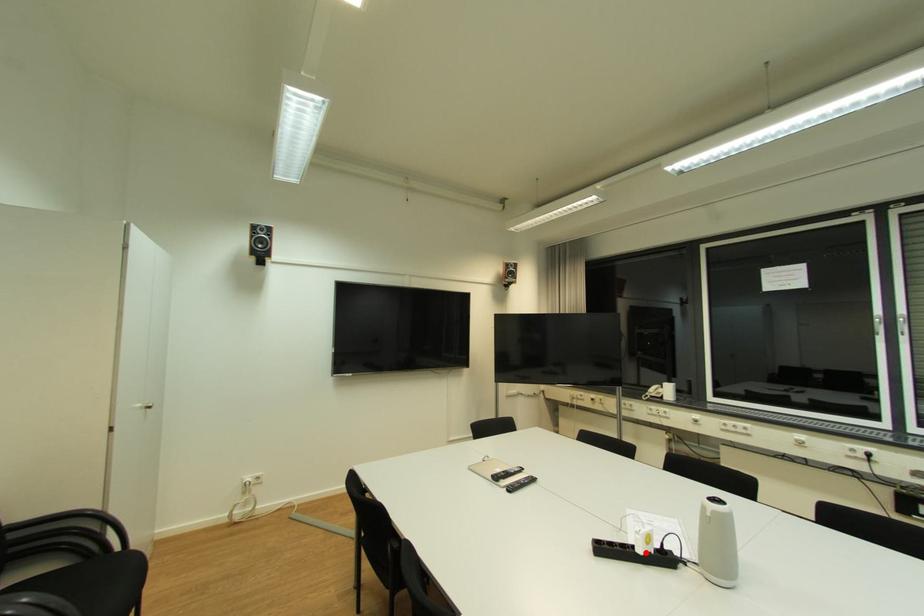
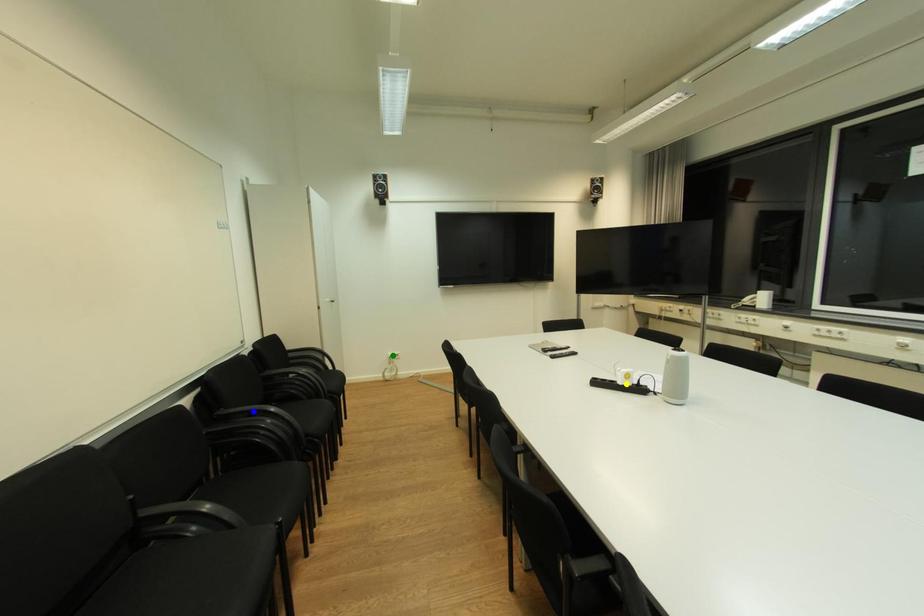
Question: I am providing you with two images of the same scene from different viewpoints. A red point is marked on the first image. You are given multiple points on the second image. Can you choose the point in image 2 that corresponds to the point in image 1?

Choices:
 (A) blue point
 (B) green point
 (C) yellow point

Answer: (C)